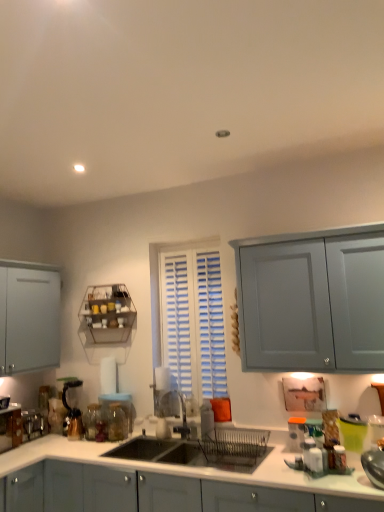
You are a GUI agent. You are given a task and a screenshot of the screen. Output one action in this format:
    pyautogui.click(x=<x>, y=<y>)
    Task: Click on the free space in front of transparent glass jar at sink, the 1th glass jar viewed from the right
    The image size is (384, 512).
    Given the screenshot: What is the action you would take?
    tap(107, 450)